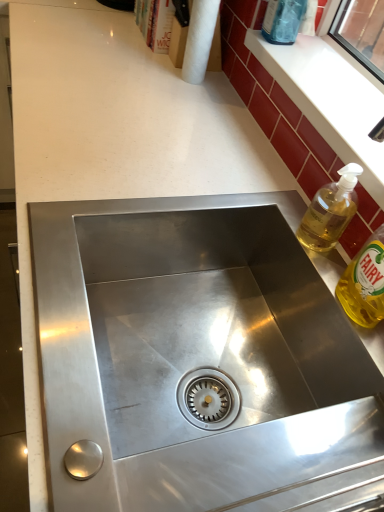
Where is `vacant area on top of white glossy window sill at upper right (from a real-world perspective)`? The image size is (384, 512). vacant area on top of white glossy window sill at upper right (from a real-world perspective) is located at coordinates (325, 85).